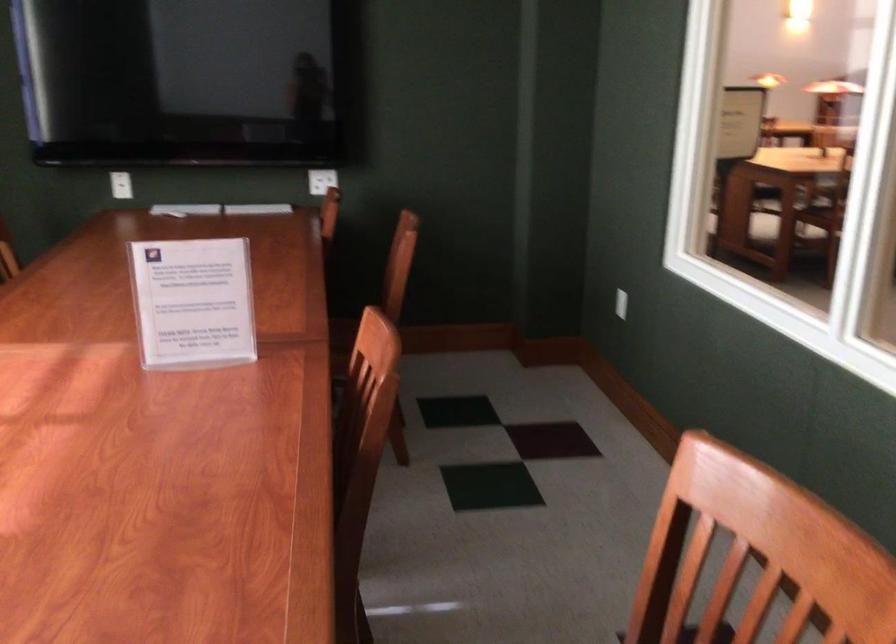
Identify the location of white light switch. (121, 185).